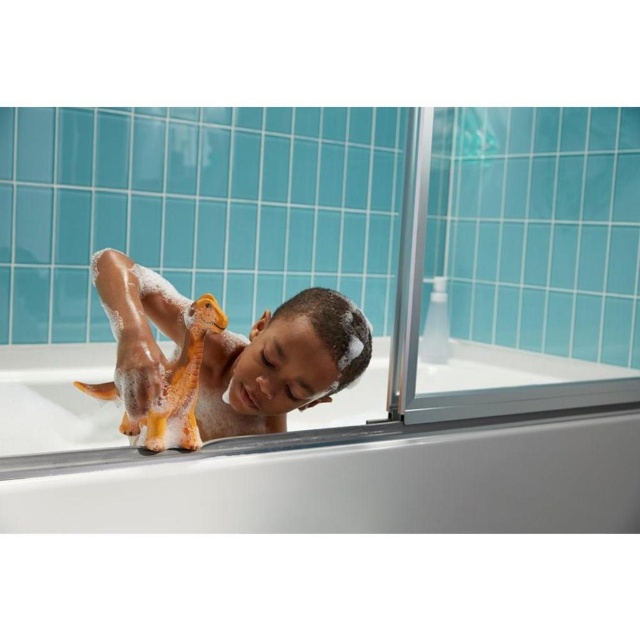
Which is above, white glossy bathtub at center or orange rubber duck at center?

Positioned higher is orange rubber duck at center.

Is white glossy bathtub at center to the right of orange rubber duck at center from the viewer's perspective?

Correct, you'll find white glossy bathtub at center to the right of orange rubber duck at center.

Where is `white glossy bathtub at center`? This screenshot has height=640, width=640. white glossy bathtub at center is located at coordinates (314, 472).